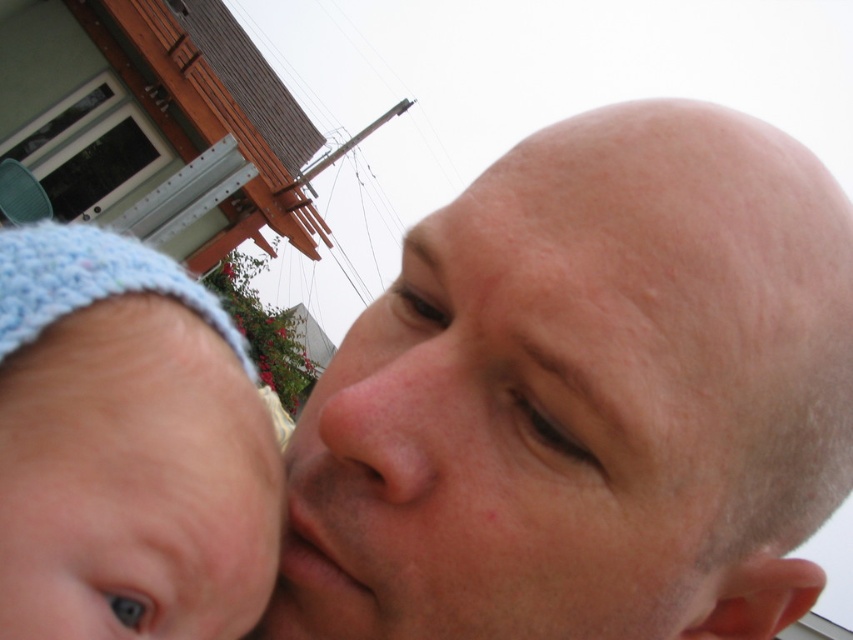
You are standing in front of the image and want to touch both the point at coordinates (846, 436) and the point at coordinates (143, 388). Which point would you need to reach out further to touch?

The point at coordinates (143, 388) requires reaching further because it is closer to you than the point at coordinates (846, 436), which is farther away.

You are a photographer trying to capture a portrait of the smooth skin head at center and the pink smooth skin at center. Which one is closer to the camera?

The smooth skin head at center is closer to the camera than the pink smooth skin at center because it is in front of it.

You are a photographer adjusting your camera to focus on the smooth skin head at center. What are the exact coordinates where you should position the focus point?

The smooth skin head at center should be focused at coordinates point (585, 397).